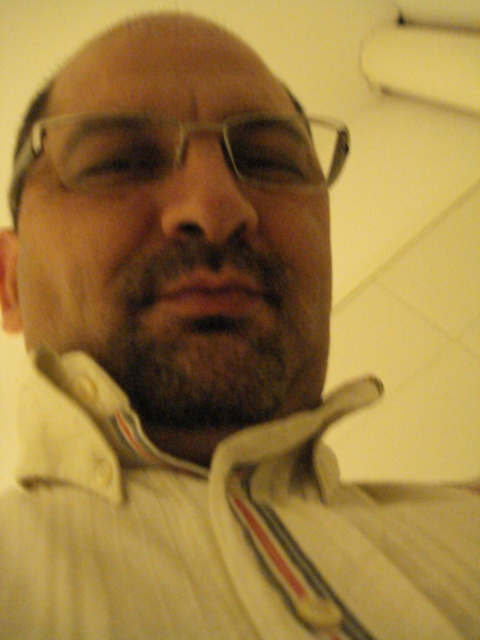
You are a photographer trying to capture a close detail shot of the clear plastic glasses at center. However, the white ribbed fabric at center is blocking your view. Can you move the fabric to get an unobstructed view of the glasses?

The white ribbed fabric at center is in front of the clear plastic glasses at center, so moving the fabric would allow you to see the glasses without obstruction.

You are standing in front of a person with a short beard and mustache, looking at their closed eyes. There are two points marked on their face. Can you tell me which point is closer to you, the point at coordinate (155, 636) or the point at (335, 173)?

Point (155, 636) is in front of point (335, 173), so the point at coordinate (155, 636) is closer to you.